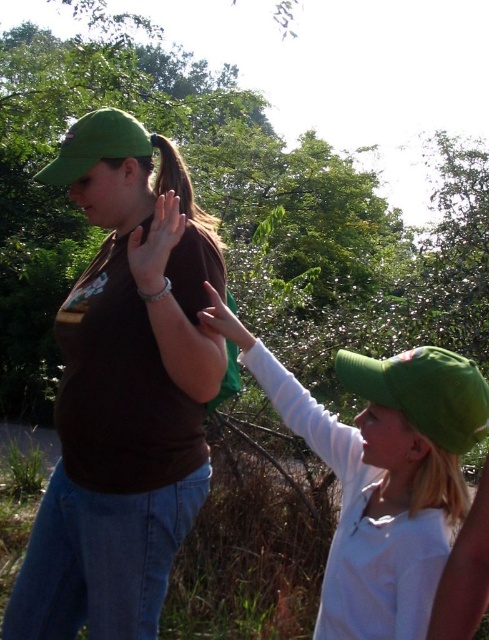
Consider the image. Which is more to the left, brown matte shirt at center or matte brown hand at center?

brown matte shirt at center is more to the left.

Measure the distance from brown matte shirt at center to matte brown hand at center.

brown matte shirt at center is 35.84 centimeters away from matte brown hand at center.

Which is behind, point (119, 211) or point (217, 316)?

Point (119, 211)

Locate an element on the screen. brown matte shirt at center is located at coordinates coord(123,400).

Is brown matte shirt at center wider than green fabric baseball cap at upper left?

Correct, the width of brown matte shirt at center exceeds that of green fabric baseball cap at upper left.

Is brown matte shirt at center further to camera compared to green fabric baseball cap at upper left?

No, it is not.

Is point (107, 444) closer to viewer compared to point (75, 138)?

Yes, point (107, 444) is in front of point (75, 138).

Where is `brown matte shirt at center`? This screenshot has height=640, width=489. brown matte shirt at center is located at coordinates (123, 400).

In the scene shown: Who is more forward, (456, 369) or (242, 330)?

Positioned in front is point (456, 369).

Image resolution: width=489 pixels, height=640 pixels. Find the location of `green fabric baseball cap at right`. green fabric baseball cap at right is located at coordinates (423, 392).